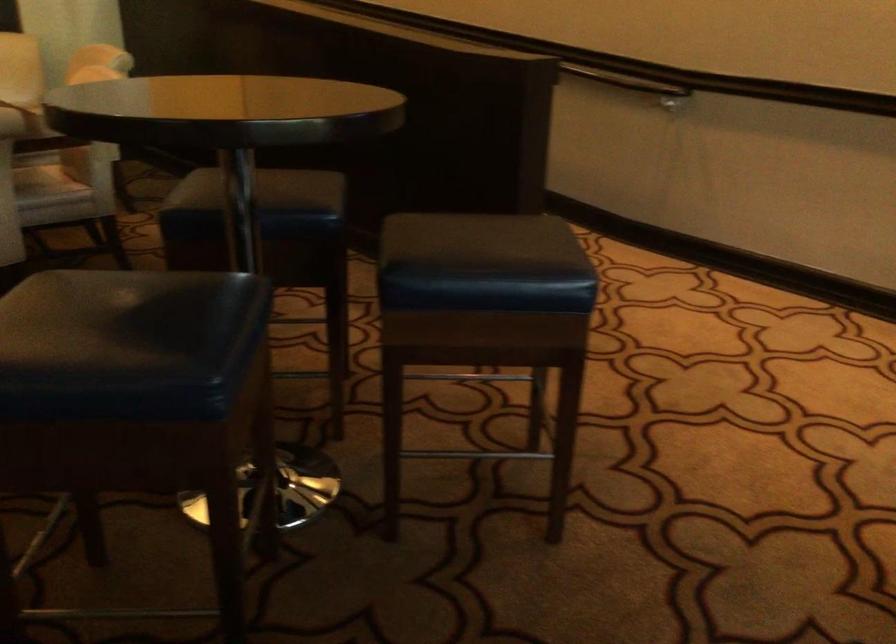
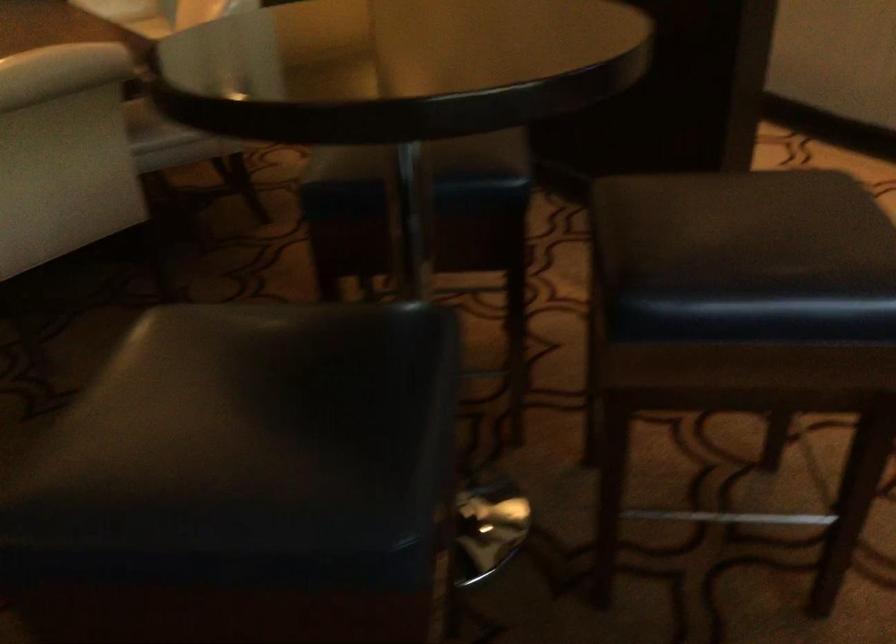
Question: The camera is either moving clockwise (left) or counter-clockwise (right) around the object. The first image is from the beginning of the video and the second image is from the end. Is the camera moving left or right when shooting the video?

Choices:
 (A) Left
 (B) Right

Answer: (B)